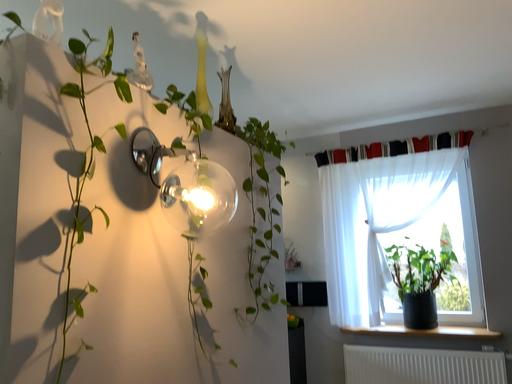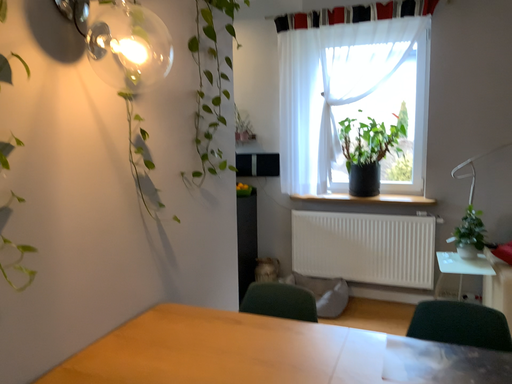
Question: How did the camera likely rotate when shooting the video?

Choices:
 (A) rotated downward
 (B) rotated upward

Answer: (A)